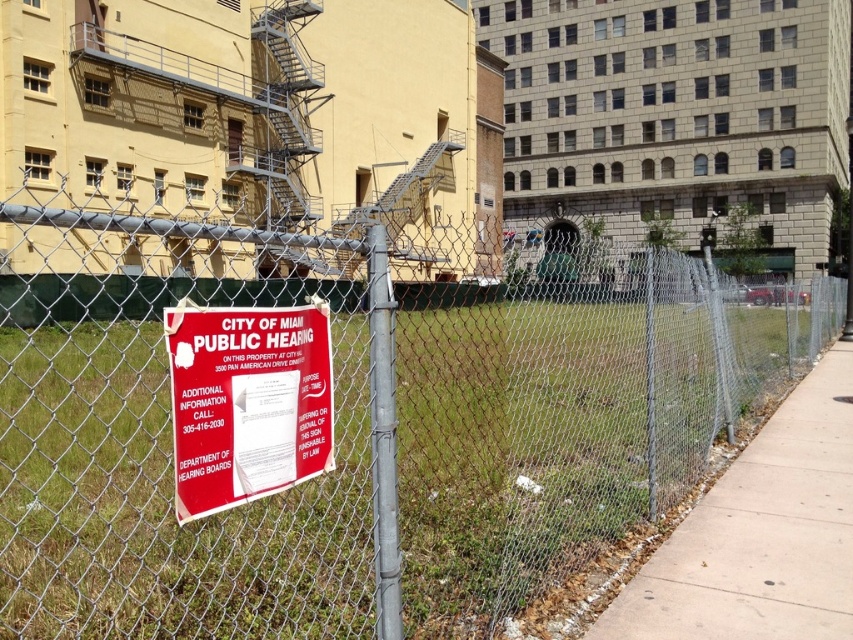
You are a pedestrian standing on the concrete sidewalk at lower right and want to read the red paper sign at center. Which direction should you move to get closer to the sign?

The concrete sidewalk at lower right is to the right of the red paper sign at center, so you should move to the left to get closer to the sign.